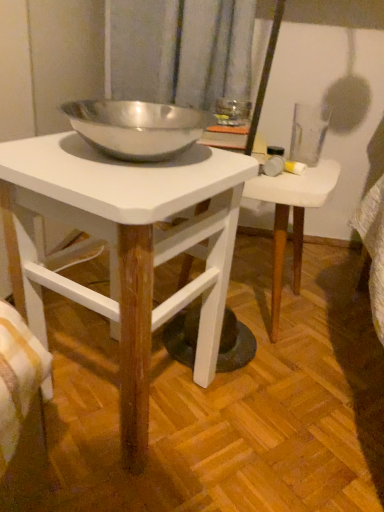
Where is `vacant space in white matte table at center, which is the first table from front to back (from a real-world perspective)`? The height and width of the screenshot is (512, 384). vacant space in white matte table at center, which is the first table from front to back (from a real-world perspective) is located at coordinates (117, 395).